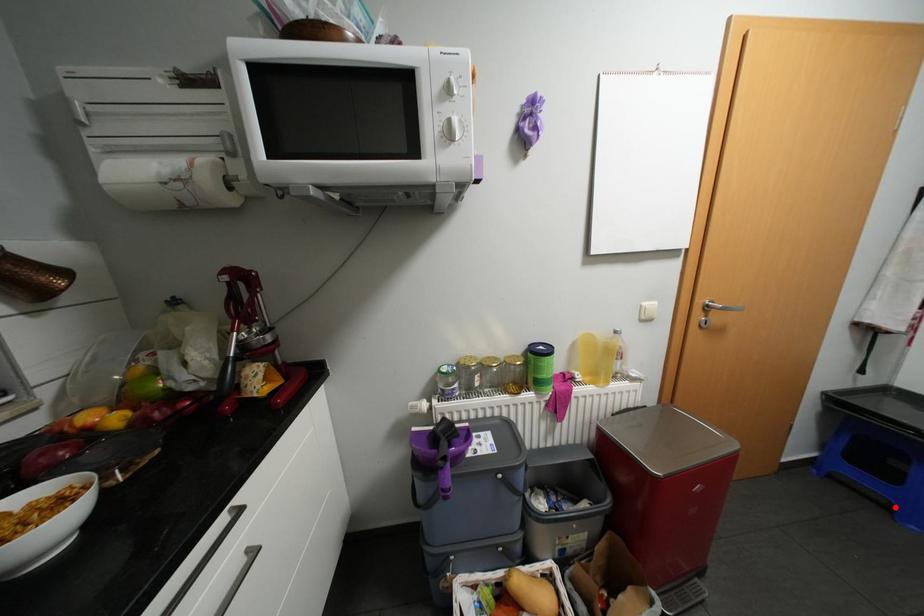
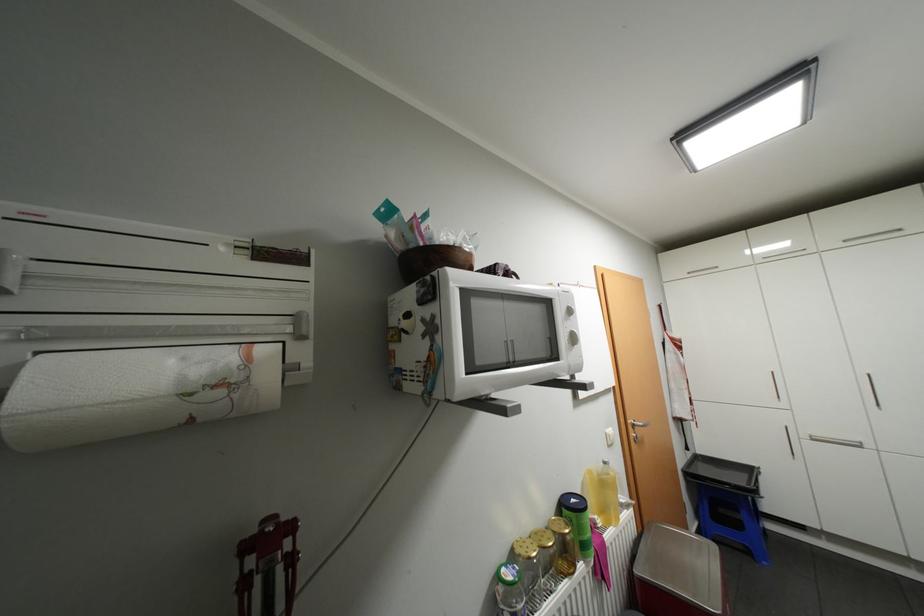
Question: I am providing you with two images of the same scene from different viewpoints. In image1, a red point is highlighted. Considering the same 3D point in image2, which of the following is correct?

Choices:
 (A) It is closer
 (B) It is farther

Answer: (A)